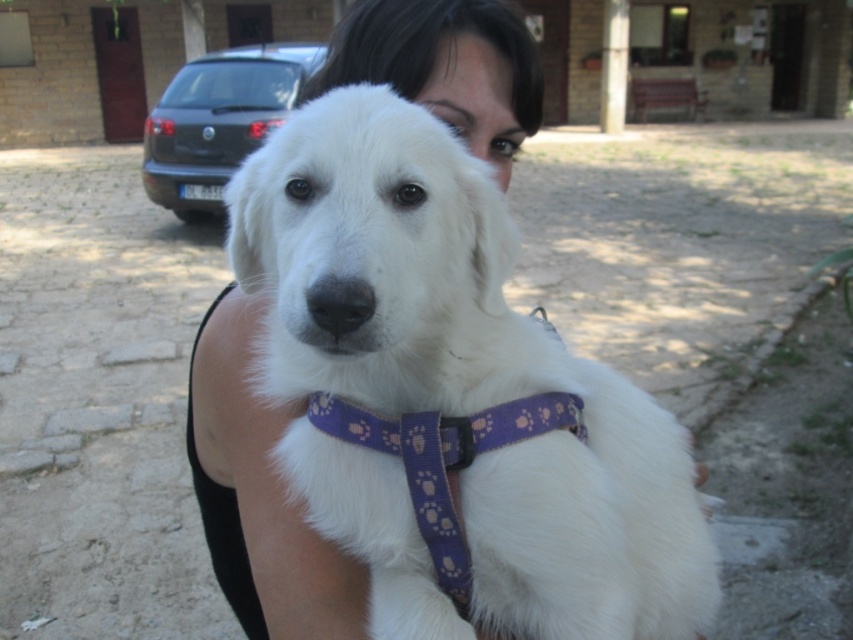
You are trying to take a photo of the white fabric dog at center and the purple fabric neckband at center. Which object will appear larger in your photo?

The white fabric dog at center will appear larger in the photo because it is closer to the viewer than the purple fabric neckband at center.

You are a photographer trying to capture a close shot of the white fabric dog at center. The camera has a focus point at coordinates 0.609, 0.532. Will the focus point align with the dog?

The white fabric dog at center is located at point (453, 388), so yes, the focus point aligns perfectly with the dog.

You are a dog trainer holding a measuring tape. You need to check if the distance between the white fabric dog at center and the purple fabric neckband at center is less than 11 centimeters. Can you confirm?

The white fabric dog at center and purple fabric neckband at center are 10.57 centimeters apart, which is less than 11 centimeters. Yes, the distance is within the required limit.